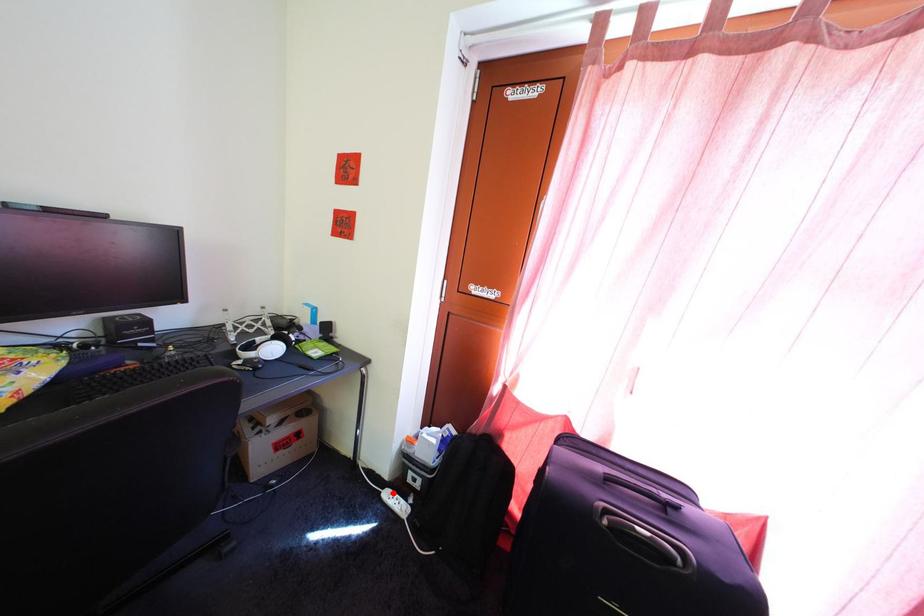
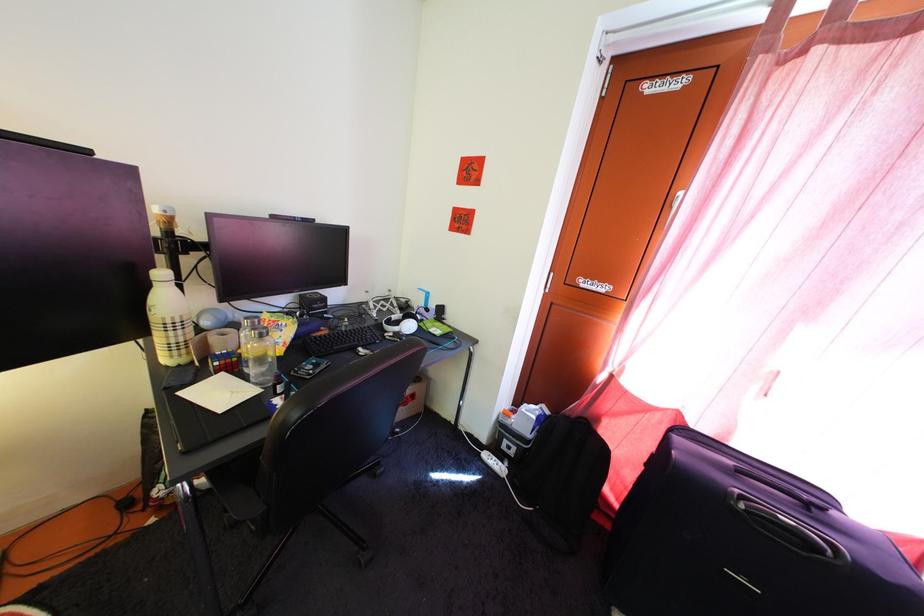
In the second image, find the point that corresponds to the highlighted location in the first image.

(492, 456)